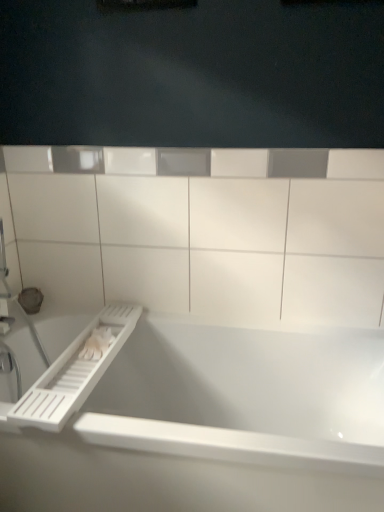
This screenshot has width=384, height=512. What do you see at coordinates (206, 424) in the screenshot?
I see `white glossy bathtub at center` at bounding box center [206, 424].

Describe the element at coordinates (203, 234) in the screenshot. The width and height of the screenshot is (384, 512). I see `white plastic ledge at upper center` at that location.

The image size is (384, 512). Find the location of `white plastic towel bar at lower left`. white plastic towel bar at lower left is located at coordinates (73, 373).

From the image's perspective, would you say white plastic ledge at upper center is shown under white glossy bathtub at center?

Incorrect, from the image's perspective, white plastic ledge at upper center is higher than white glossy bathtub at center.

Which object is further away from the camera, white plastic ledge at upper center or white glossy bathtub at center?

white plastic ledge at upper center.

Is white plastic ledge at upper center far from white glossy bathtub at center?

No, white plastic ledge at upper center is in close proximity to white glossy bathtub at center.

From the image's perspective, is white glossy bathtub at center located above or below white plastic towel bar at lower left?

From the image's perspective, white glossy bathtub at center appears below white plastic towel bar at lower left.

Can you confirm if white glossy bathtub at center is thinner than white plastic towel bar at lower left?

Incorrect, the width of white glossy bathtub at center is not less than that of white plastic towel bar at lower left.

Looking at this image, from a real-world perspective, between white glossy bathtub at center and white plastic towel bar at lower left, who is vertically lower?

white glossy bathtub at center is physically lower.

From a real-world perspective, is white plastic towel bar at lower left beneath white plastic ledge at upper center?

Correct, in the physical world, white plastic towel bar at lower left is lower than white plastic ledge at upper center.

In the scene shown: Can you confirm if white plastic towel bar at lower left is bigger than white plastic ledge at upper center?

No, white plastic towel bar at lower left is not bigger than white plastic ledge at upper center.

Considering the sizes of white plastic towel bar at lower left and white plastic ledge at upper center in the image, is white plastic towel bar at lower left taller or shorter than white plastic ledge at upper center?

Considering their sizes, white plastic towel bar at lower left has less height than white plastic ledge at upper center.

Based on the photo, which is in front, white plastic towel bar at lower left or white plastic ledge at upper center?

white plastic towel bar at lower left is closer to the camera.

Is white plastic towel bar at lower left not within white glossy bathtub at center?

No, white plastic towel bar at lower left is not outside of white glossy bathtub at center.

In terms of size, does white plastic towel bar at lower left appear bigger or smaller than white glossy bathtub at center?

Considering their sizes, white plastic towel bar at lower left takes up less space than white glossy bathtub at center.

Which object is thinner, white plastic towel bar at lower left or white glossy bathtub at center?

Thinner between the two is white plastic towel bar at lower left.

Is white plastic ledge at upper center a part of white glossy bathtub at center?

No, white glossy bathtub at center does not contain white plastic ledge at upper center.

What's the angular difference between white glossy bathtub at center and white plastic ledge at upper center's facing directions?

There is a 0.0606-degree angle between the facing directions of white glossy bathtub at center and white plastic ledge at upper center.

Can you confirm if white glossy bathtub at center is taller than white plastic ledge at upper center?

No.

Is white glossy bathtub at center positioned with its back to white plastic ledge at upper center?

No, white glossy bathtub at center is not facing away from white plastic ledge at upper center.

Looking at this image, is white plastic ledge at upper center situated inside white plastic towel bar at lower left or outside?

white plastic ledge at upper center is not enclosed by white plastic towel bar at lower left.

From the image's perspective, which is above, white plastic ledge at upper center or white plastic towel bar at lower left?

From the image's view, white plastic ledge at upper center is above.

From a real-world perspective, is white plastic ledge at upper center under white plastic towel bar at lower left?

Actually, white plastic ledge at upper center is physically above white plastic towel bar at lower left in the real world.

At what (x,y) coordinates should I click in order to perform the action: click on bathtub below the white plastic ledge at upper center (from the image's perspective). Please return your answer as a coordinate pair (x, y). The height and width of the screenshot is (512, 384). Looking at the image, I should click on (206, 424).

The width and height of the screenshot is (384, 512). I want to click on towel bar that is above the white glossy bathtub at center (from a real-world perspective), so click(73, 373).

When comparing their distances from white glossy bathtub at center, does white plastic towel bar at lower left or white plastic ledge at upper center seem closer?

Based on the image, white plastic towel bar at lower left appears to be nearer to white glossy bathtub at center.

Looking at the image, which one is located closer to white plastic towel bar at lower left, white plastic ledge at upper center or white glossy bathtub at center?

Based on the image, white glossy bathtub at center appears to be nearer to white plastic towel bar at lower left.

From the image, which object appears to be nearer to white glossy bathtub at center, white plastic ledge at upper center or white plastic towel bar at lower left?

white plastic towel bar at lower left is closer to white glossy bathtub at center.

Based on their spatial positions, is white glossy bathtub at center or white plastic ledge at upper center closer to white plastic towel bar at lower left?

white glossy bathtub at center is closer to white plastic towel bar at lower left.

From the image, which object appears to be farther from white plastic ledge at upper center, white plastic towel bar at lower left or white glossy bathtub at center?

Among the two, white plastic towel bar at lower left is located further to white plastic ledge at upper center.

Looking at the image, which one is located further to white plastic ledge at upper center, white glossy bathtub at center or white plastic towel bar at lower left?

Based on the image, white plastic towel bar at lower left appears to be further to white plastic ledge at upper center.

Locate an element on the screen. towel bar between white plastic ledge at upper center and white glossy bathtub at center in the vertical direction is located at coordinates (73, 373).